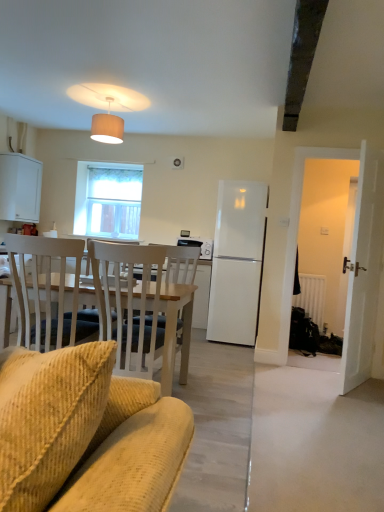
Question: Is white matte cabinet at left next to dark gray metallic exhaust hood at upper right?

Choices:
 (A) yes
 (B) no

Answer: (B)

Question: From the image's perspective, does white matte cabinet at left appear lower than dark gray metallic exhaust hood at upper right?

Choices:
 (A) yes
 (B) no

Answer: (A)

Question: Is white matte cabinet at left at the right side of dark gray metallic exhaust hood at upper right?

Choices:
 (A) yes
 (B) no

Answer: (B)

Question: From a real-world perspective, is white matte cabinet at left located beneath dark gray metallic exhaust hood at upper right?

Choices:
 (A) yes
 (B) no

Answer: (A)

Question: From a real-world perspective, is white matte cabinet at left positioned over dark gray metallic exhaust hood at upper right based on gravity?

Choices:
 (A) yes
 (B) no

Answer: (B)

Question: Does white matte cabinet at left have a lesser height compared to dark gray metallic exhaust hood at upper right?

Choices:
 (A) no
 (B) yes

Answer: (A)

Question: Is white matte refrigerator at center positioned with its back to white matte cabinet at left?

Choices:
 (A) yes
 (B) no

Answer: (B)

Question: From a real-world perspective, is white matte refrigerator at center on white matte cabinet at left?

Choices:
 (A) no
 (B) yes

Answer: (A)

Question: Is white matte refrigerator at center taller than white matte cabinet at left?

Choices:
 (A) no
 (B) yes

Answer: (B)

Question: Does white matte refrigerator at center have a lesser width compared to white matte cabinet at left?

Choices:
 (A) no
 (B) yes

Answer: (A)

Question: Can you confirm if white matte refrigerator at center is positioned to the right of white matte cabinet at left?

Choices:
 (A) yes
 (B) no

Answer: (A)

Question: Is white matte refrigerator at center in contact with white matte cabinet at left?

Choices:
 (A) no
 (B) yes

Answer: (A)

Question: Is wooden chair at left outside of beige ribbed lampshade at upper center?

Choices:
 (A) no
 (B) yes

Answer: (B)